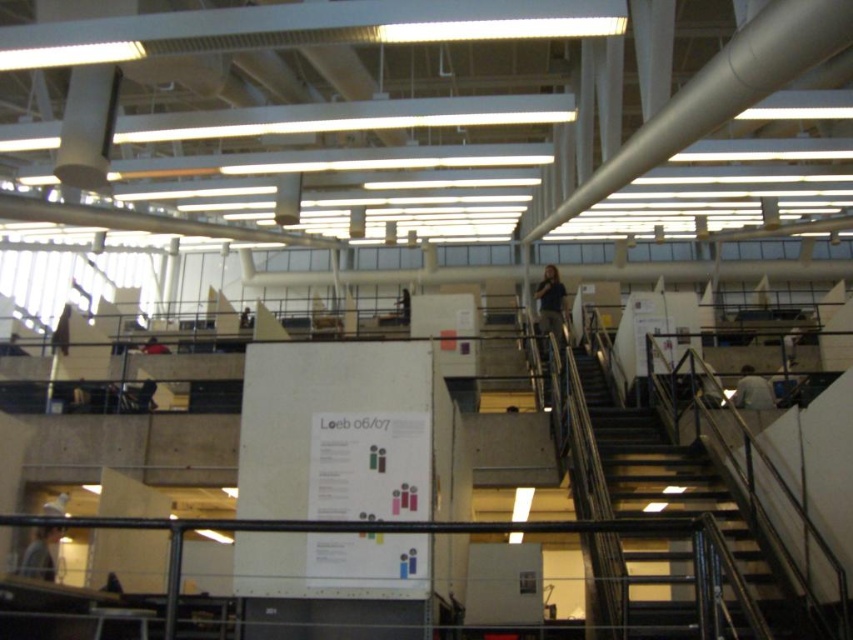
You are an office manager checking the layout of the office space. You notice two employees wearing the light brown fabric shirt at lower right and the dark blue shirt at lower left. Which employee is wearing a wider shirt?

The light brown fabric shirt at lower right is wider than the dark blue shirt at lower left, so the employee wearing the light brown fabric shirt at lower right has a wider shirt.

You are standing at the bottom of the staircase in the image and want to greet the person wearing the light brown fabric shirt at lower right. Which direction should you walk to approach them before they reach the dark blue shirt at lower left?

The light brown fabric shirt at lower right is positioned under dark blue shirt at lower left, so you should walk upwards towards the upper levels to approach the light brown fabric shirt at lower right before they reach the dark blue shirt at lower left.